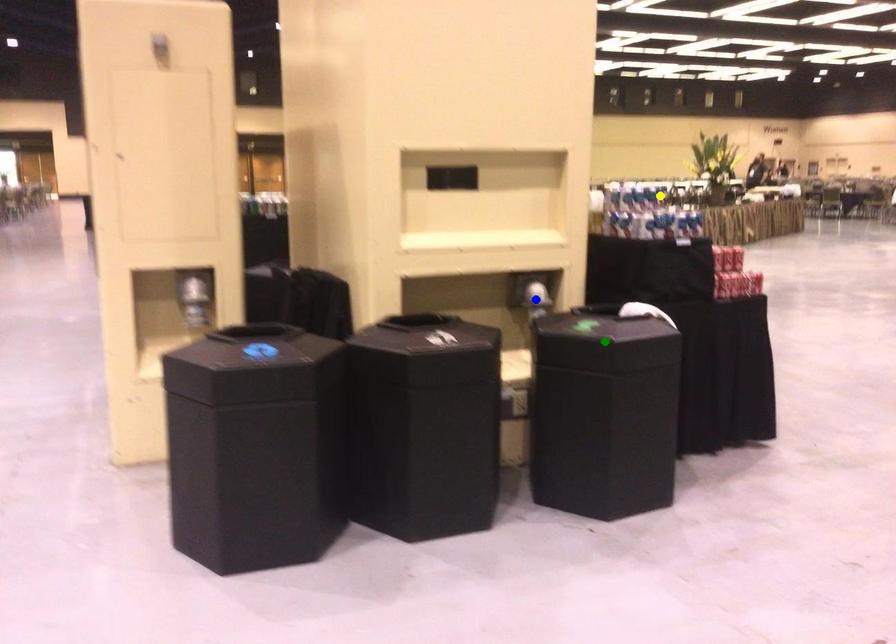
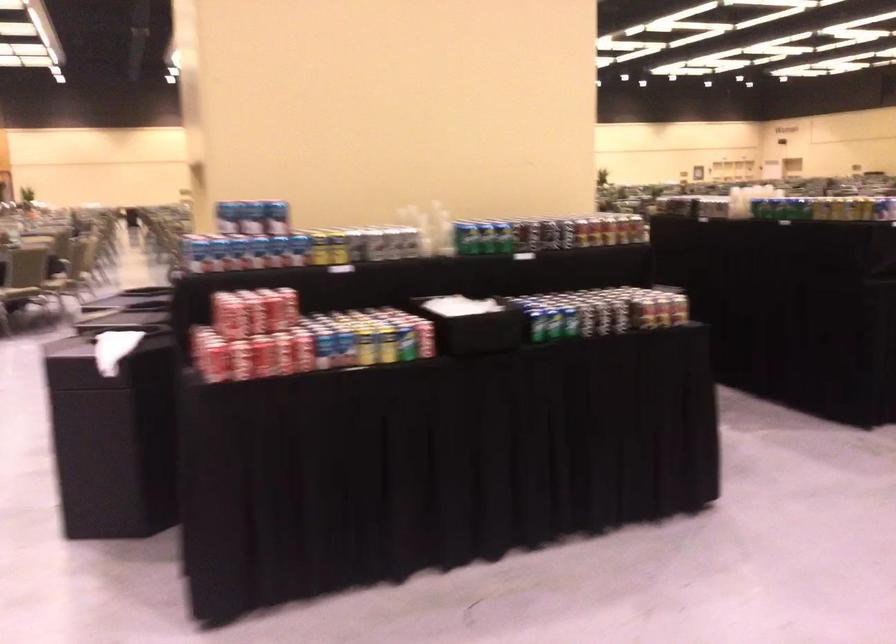
I am providing you with two images of the same scene from different viewpoints. Three points are marked in image1. Which point corresponds to a part or object that is occluded in image2?In image1, three points are marked. Which of them correspond to a part or object that is occluded in image2?Among the three points shown in image1, which one corresponds to a part or object that is no longer visible due to occlusion in image2?

blue point, green point